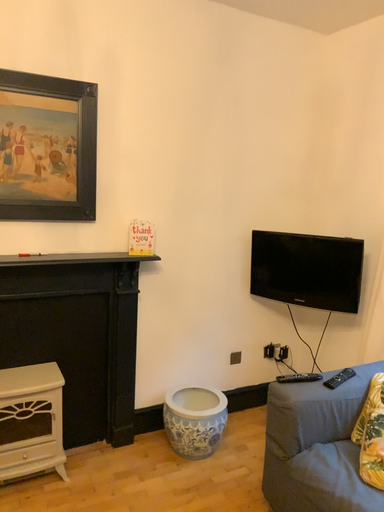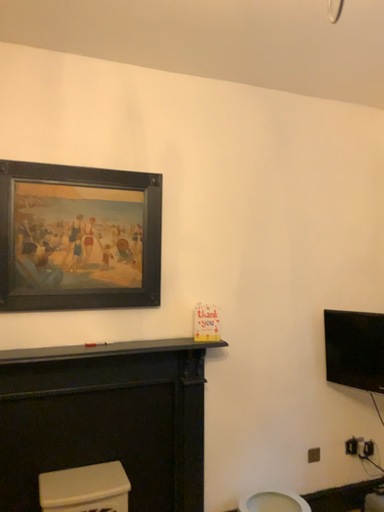
Question: How did the camera likely rotate when shooting the video?

Choices:
 (A) rotated right
 (B) rotated left

Answer: (B)